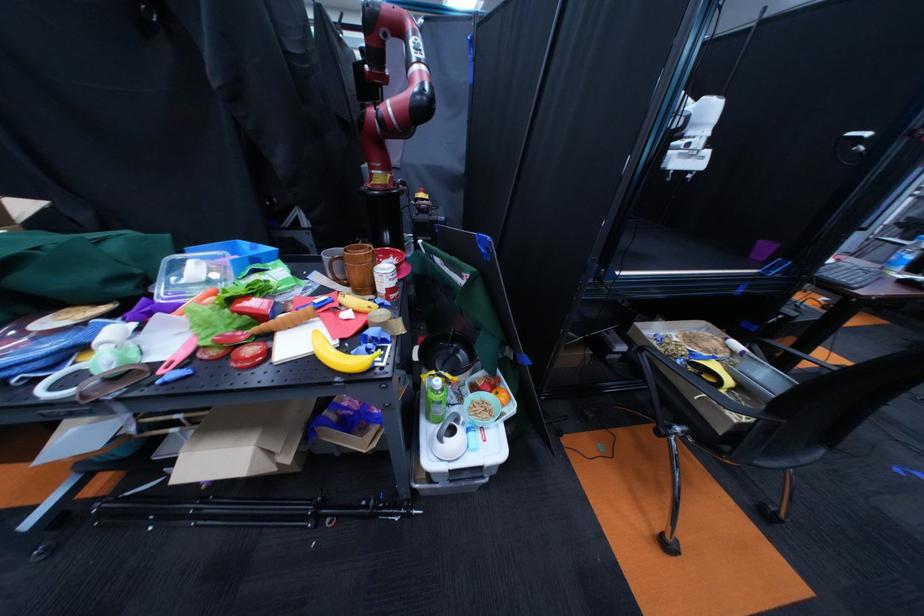
You are a GUI agent. You are given a task and a screenshot of the screen. Output one action in this format:
    pyautogui.click(x=<x>, y=<y>)
    Task: Click on the green spray bottle
    The height and width of the screenshot is (616, 924).
    Given the screenshot: What is the action you would take?
    coord(435,399)